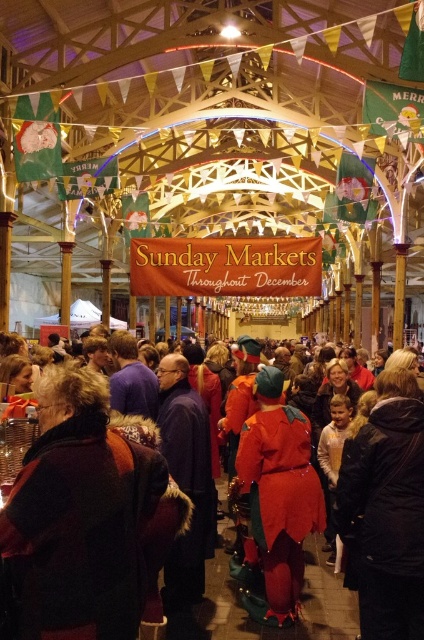
You are a photographer wanting to capture both the dark brown fur coat at center and the shiny red costume at center in a single frame. Based on their positions, which object should you focus on first to ensure both are in the shot?

Since the dark brown fur coat at center is to the left of the shiny red costume at center, you should focus on the dark brown fur coat at center first to ensure both are included in the frame.

You are a vendor at the market and need to decide which of the two items to place on a small display table that can only accommodate one item. Given the dark brown fur coat at center and the shiny red costume at center, which item should you choose to ensure it fits properly?

The shiny red costume at center should be chosen because it is smaller in size than the dark brown fur coat at center, making it more likely to fit on the small display table.